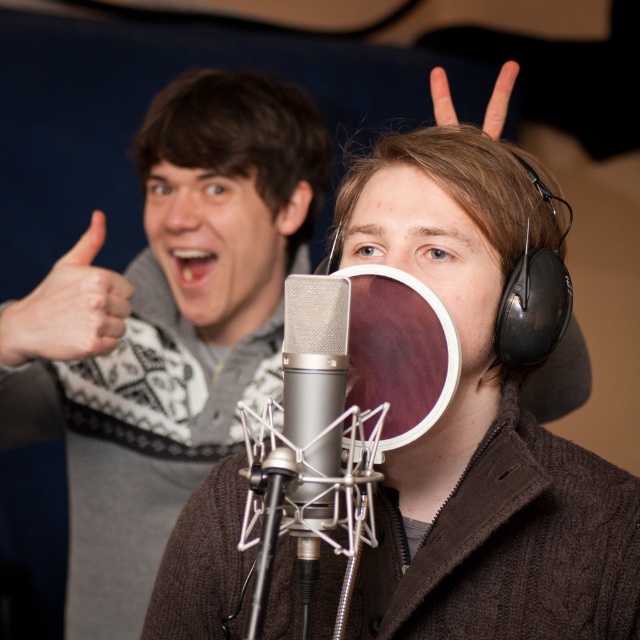
You are standing in the recording studio and want to place a small plant exactly at the point marked as point (308, 333). The plant has a diameter of 12 inches. Will the plant fit entirely within the studio space at that location?

The point (308, 333) is 31.23 inches away from the viewer, so placing a 12 inch diameter plant there would fit since the distance is greater than the plant size.